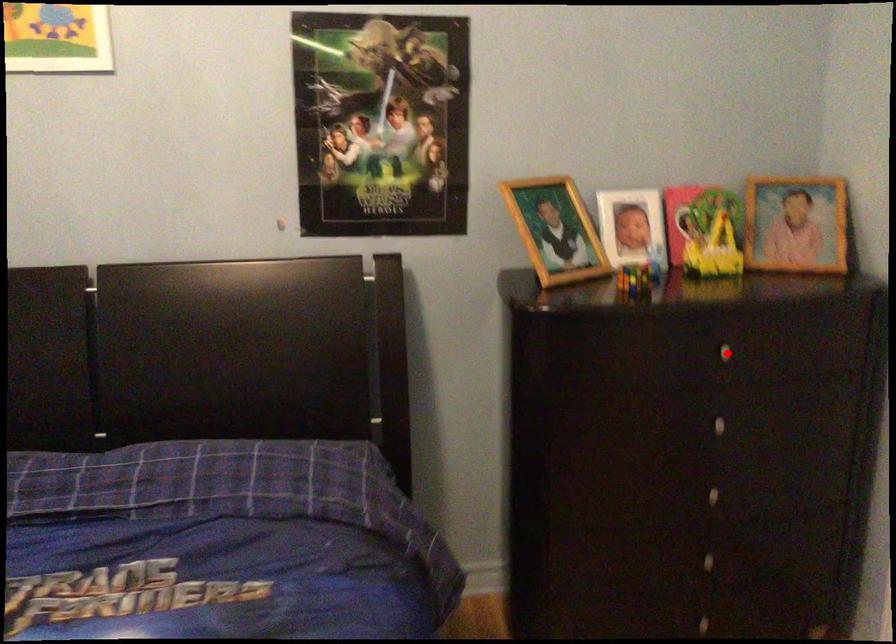
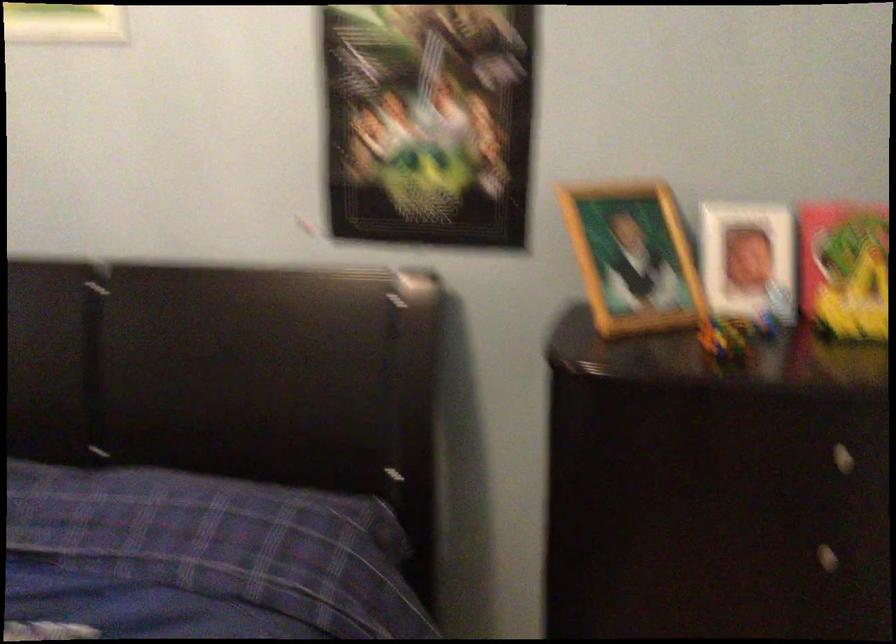
Question: I am providing you with two images of the same scene from different viewpoints. In image1, a red point is highlighted. Considering the same 3D point in image2, which of the following is correct?

Choices:
 (A) It is closer
 (B) It is farther

Answer: (A)